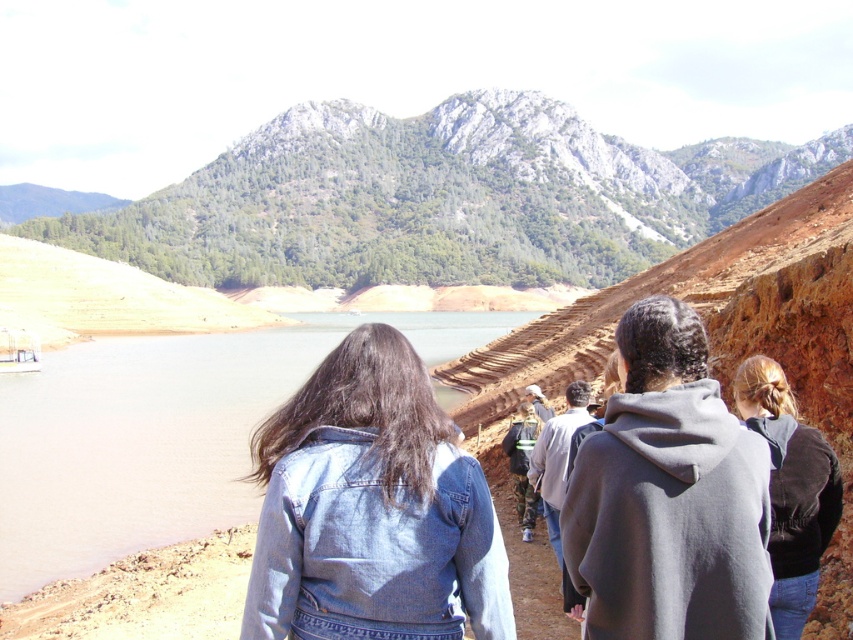
Can you confirm if denim jacket at lower center is positioned below black velvet jacket at right?

Correct, denim jacket at lower center is located below black velvet jacket at right.

Between point (375, 605) and point (815, 557), which one is positioned behind?

The point (815, 557) is more distant.

The height and width of the screenshot is (640, 853). Find the location of `denim jacket at lower center`. denim jacket at lower center is located at coordinates (370, 508).

Between brown matte water at lower left and gray fleece jacket at center, which one has less height?

Standing shorter between the two is gray fleece jacket at center.

Can you confirm if brown matte water at lower left is smaller than gray fleece jacket at center?

No.

Who is more forward, (39, 426) or (737, 420)?

Point (737, 420)

I want to click on brown matte water at lower left, so pos(161,435).

Who is more distant from viewer, (370, 224) or (415, 624)?

Point (370, 224)

This screenshot has width=853, height=640. I want to click on rugged stone mountain at upper center, so click(x=440, y=198).